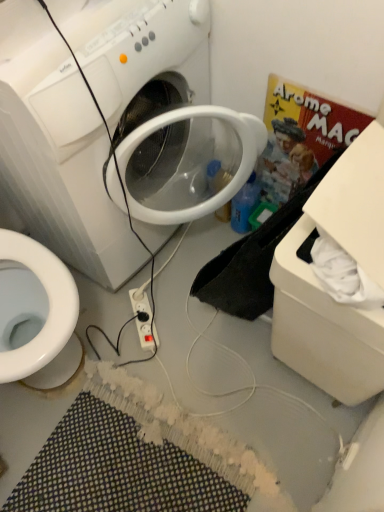
You are a GUI agent. You are given a task and a screenshot of the screen. Output one action in this format:
    pyautogui.click(x=<x>, y=<y>)
    Task: Click on the free space that is in between multicolored woven bath mat at lower center and white plastic power outlet at center
    
    Given the screenshot: What is the action you would take?
    pyautogui.click(x=160, y=371)